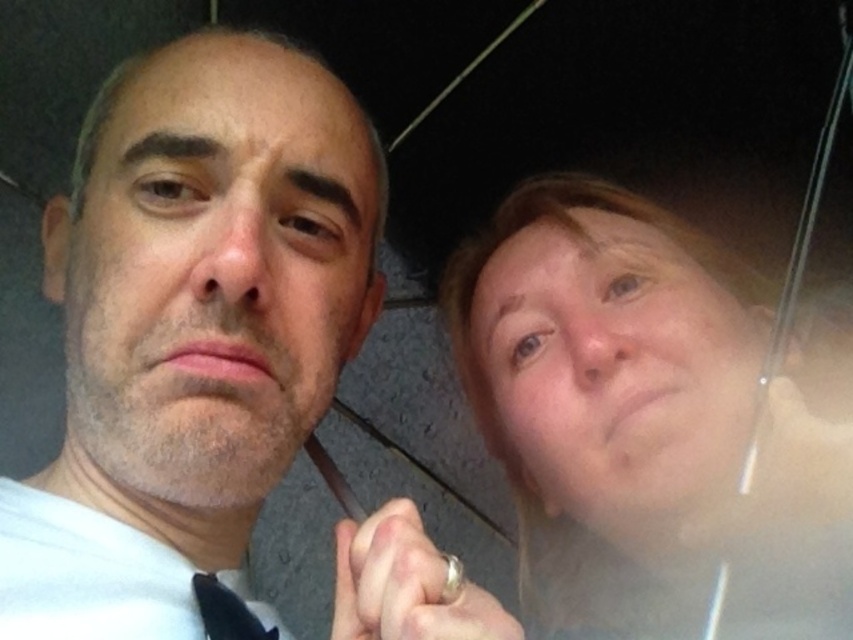
Based on the scene description, how far apart are the two individuals standing under the translucent plastic umbrella at upper right?

The two individuals are standing 22.49 inches apart under the translucent plastic umbrella at upper right.

You are a photographer trying to capture a closeup of the smooth skin face at right without the translucent plastic umbrella at upper right appearing in the frame. Is this possible given their positions?

The translucent plastic umbrella at upper right is to the right of the smooth skin face at right, so it might be possible to adjust the camera angle slightly to the left to exclude the umbrella from the frame while still capturing the face.

What is the color of the shirt worn by the person at the point coordinates (194, 321)?

The point at coordinates (194, 321) corresponds to the matte white shirt at left.